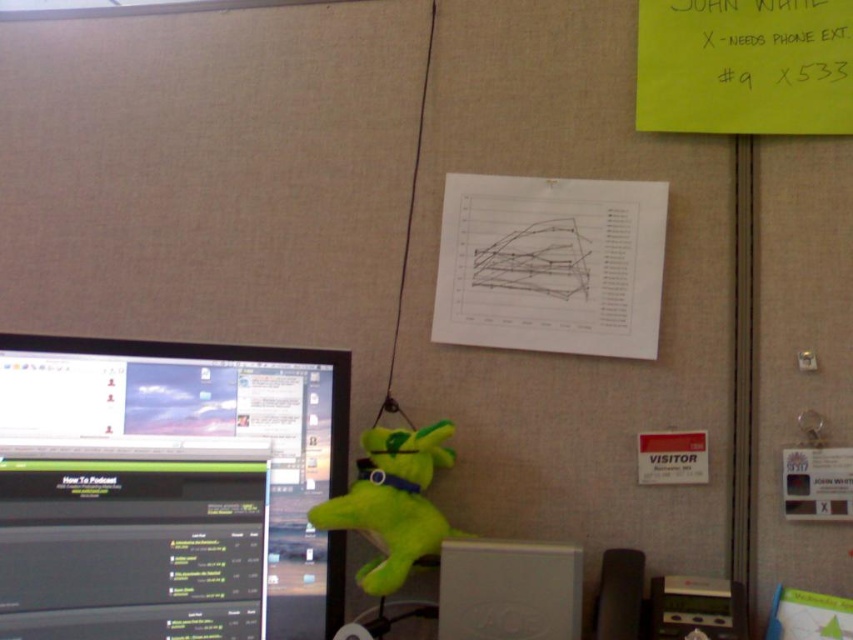
Is point (543, 616) farther from camera compared to point (430, 531)?

No.

Which is below, white plastic computer at lower center or green plush toy at center?

white plastic computer at lower center is below.

The width and height of the screenshot is (853, 640). Identify the location of white plastic computer at lower center. (508, 589).

Is point (817, 90) positioned in front of point (460, 582)?

That is False.

Between point (747, 22) and point (512, 620), which one is positioned behind?

Point (747, 22)

What do you see at coordinates (744, 67) in the screenshot?
I see `green paper at upper right` at bounding box center [744, 67].

At what (x,y) coordinates should I click in order to perform the action: click on green paper at upper right. Please return your answer as a coordinate pair (x, y). The height and width of the screenshot is (640, 853). Looking at the image, I should click on (744, 67).

Is matte black monitor at left further to camera compared to white plastic computer at lower center?

No, matte black monitor at left is in front of white plastic computer at lower center.

Is matte black monitor at left closer to the viewer compared to white plastic computer at lower center?

Yes, matte black monitor at left is closer to the viewer.

Between point (225, 529) and point (489, 589), which one is positioned in front?

Positioned in front is point (225, 529).

You are a GUI agent. You are given a task and a screenshot of the screen. Output one action in this format:
    pyautogui.click(x=<x>, y=<y>)
    Task: Click on the matte black monitor at left
    This screenshot has width=853, height=640.
    Given the screenshot: What is the action you would take?
    pyautogui.click(x=167, y=490)